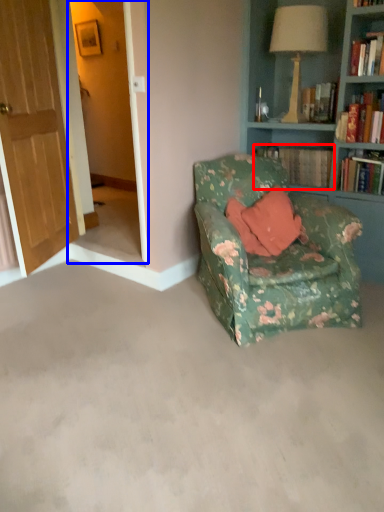
Question: Among these objects, which one is farthest to the camera, book (highlighted by a red box) or screen door (highlighted by a blue box)?

Choices:
 (A) book
 (B) screen door

Answer: (A)